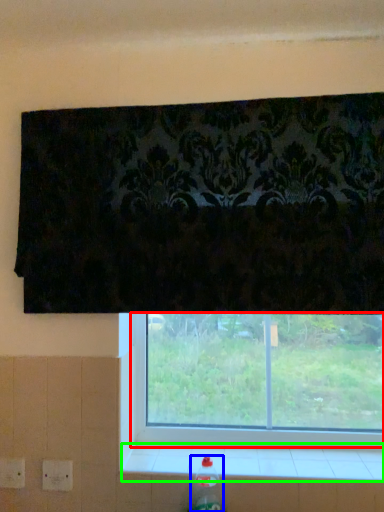
Question: Which is farther away from window (highlighted by a red box)? bottle (highlighted by a blue box) or window sill (highlighted by a green box)?

Choices:
 (A) bottle
 (B) window sill

Answer: (A)